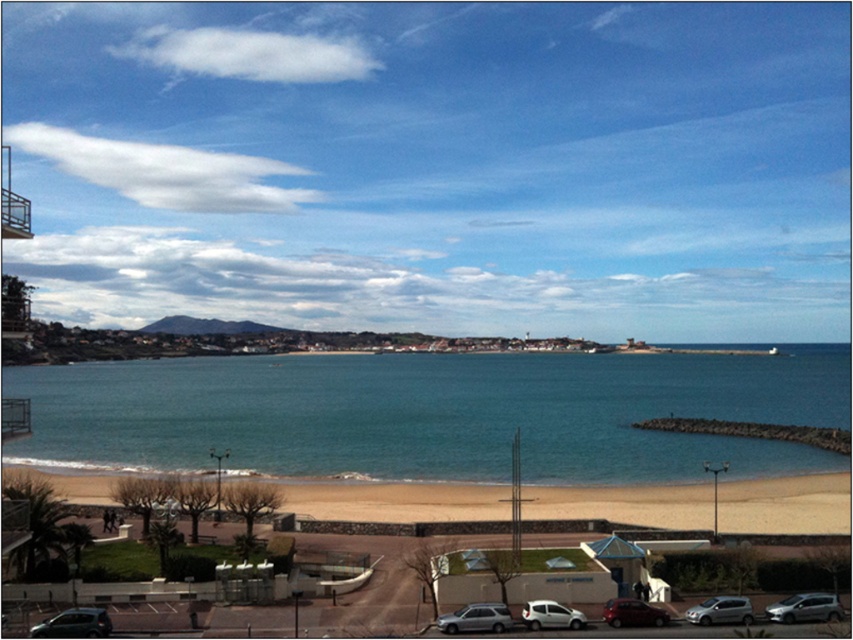
You are a photographer planning to capture a wide shot of the smooth sand beach at lower center and the silver metallic hatchback at lower right. Given that the camera can only focus on objects within a 10 meter width, will both objects fit within the frame?

The smooth sand beach at lower center is wider than the silver metallic hatchback at lower right. However, since the camera can only focus on objects within a 10 meter width, it depends on the actual widths of both objects. If the combined width of the beach and the hatchback exceeds 10 meters, they won

You are standing at point (395, 500) in the coastal scene. What type of terrain do you find yourself on?

At point (395, 500), you are standing on smooth sand beach at lower center.

You are standing on the walkway and want to take a photo of both the silver metallic car at lower center and the white matte van at lower center. Which car should you focus on first to ensure it appears clearer in the photo?

You should focus on the silver metallic car at lower center first because it is closer to the viewer than the white matte van at lower center, making it appear clearer when focused on.